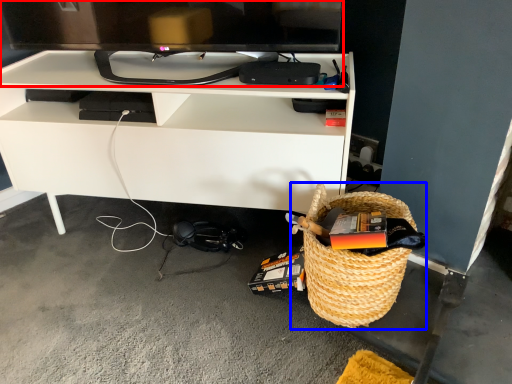
Question: Which object is further to the camera taking this photo, television (highlighted by a red box) or picnic basket (highlighted by a blue box)?

Choices:
 (A) television
 (B) picnic basket

Answer: (A)